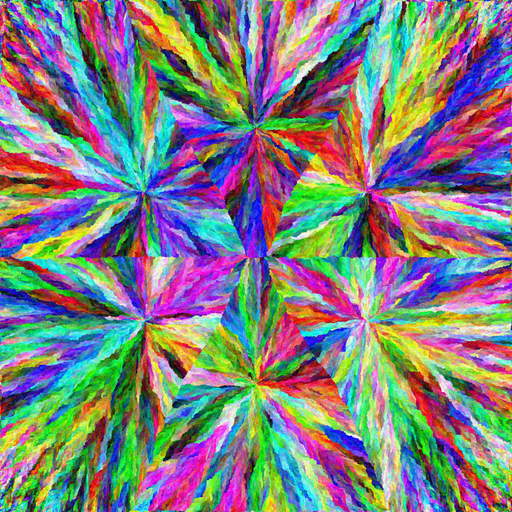
Find the location of a particular element. Image resolution: width=512 pixels, height=512 pixels. teal paint is located at coordinates (286, 400), (287, 462), (72, 372), (74, 337), (56, 270).